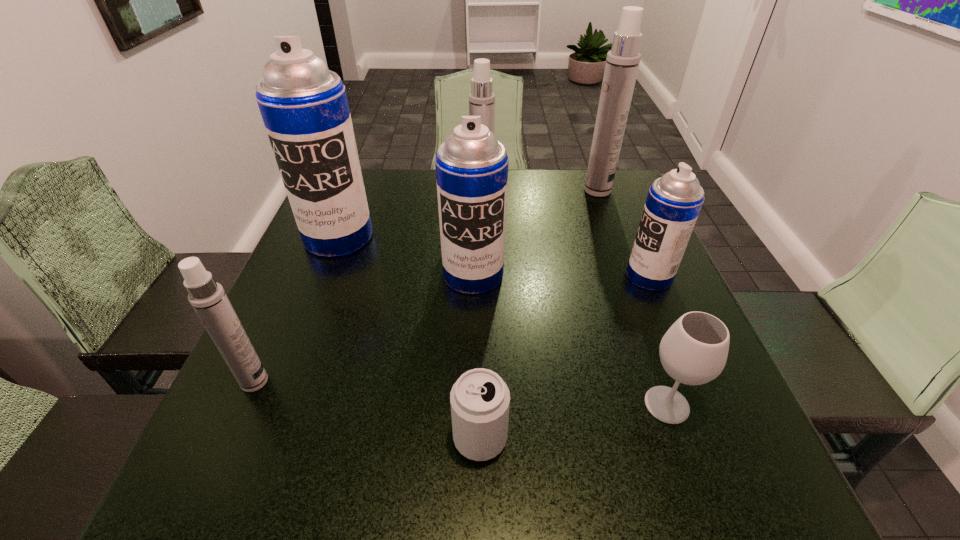
Find the location of a particular element. The height and width of the screenshot is (540, 960). vacant area that lies between the smallest blue aerosol can and the second white aerosol can from right to left is located at coordinates (565, 239).

You are a GUI agent. You are given a task and a screenshot of the screen. Output one action in this format:
    pyautogui.click(x=<x>, y=<y>)
    Task: Click on the object that stands as the second closest to the leftmost blue aerosol can
    
    Given the screenshot: What is the action you would take?
    pyautogui.click(x=481, y=99)

Locate which object ranks fourth in proximity to the wineglass. Please provide its 2D coordinates. Your answer should be formatted as a tuple, i.e. [(x, y)], where the tuple contains the x and y coordinates of a point satisfying the conditions above.

[(481, 99)]

Identify which aerosol can is the second closest to the nearest aerosol can. Please provide its 2D coordinates. Your answer should be formatted as a tuple, i.e. [(x, y)], where the tuple contains the x and y coordinates of a point satisfying the conditions above.

[(471, 166)]

The image size is (960, 540). In order to click on aerosol can that can be found as the closest to the smallest white aerosol can in this screenshot , I will do `click(304, 106)`.

Identify which white aerosol can is the third nearest to the wineglass. Please provide its 2D coordinates. Your answer should be formatted as a tuple, i.e. [(x, y)], where the tuple contains the x and y coordinates of a point satisfying the conditions above.

[(207, 297)]

Identify the location of white aerosol can that is the second closest to the leftmost blue aerosol can. This screenshot has height=540, width=960. (207, 297).

Identify which blue aerosol can is located as the third nearest to the wineglass. Please provide its 2D coordinates. Your answer should be formatted as a tuple, i.e. [(x, y)], where the tuple contains the x and y coordinates of a point satisfying the conditions above.

[(304, 106)]

Identify the location of blue aerosol can that is the closest to the second shortest object. This screenshot has width=960, height=540. (674, 201).

Where is `vacant area that satisfies the following two spatial constraints: 1. on the back side of the nearest aerosol can; 2. on the left side of the second white aerosol can from right to left`? The height and width of the screenshot is (540, 960). vacant area that satisfies the following two spatial constraints: 1. on the back side of the nearest aerosol can; 2. on the left side of the second white aerosol can from right to left is located at coordinates (335, 201).